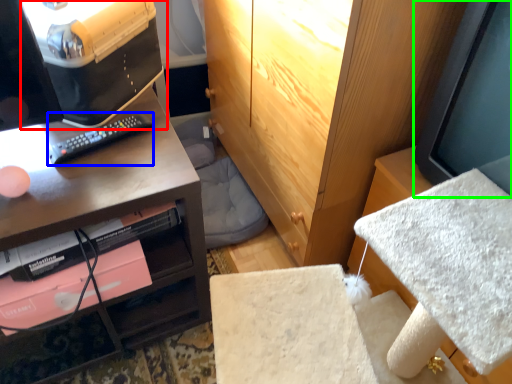
Question: Considering the real-world distances, which object is farthest from desktop computer (highlighted by a red box)? remote (highlighted by a blue box) or computer monitor (highlighted by a green box)?

Choices:
 (A) remote
 (B) computer monitor

Answer: (B)